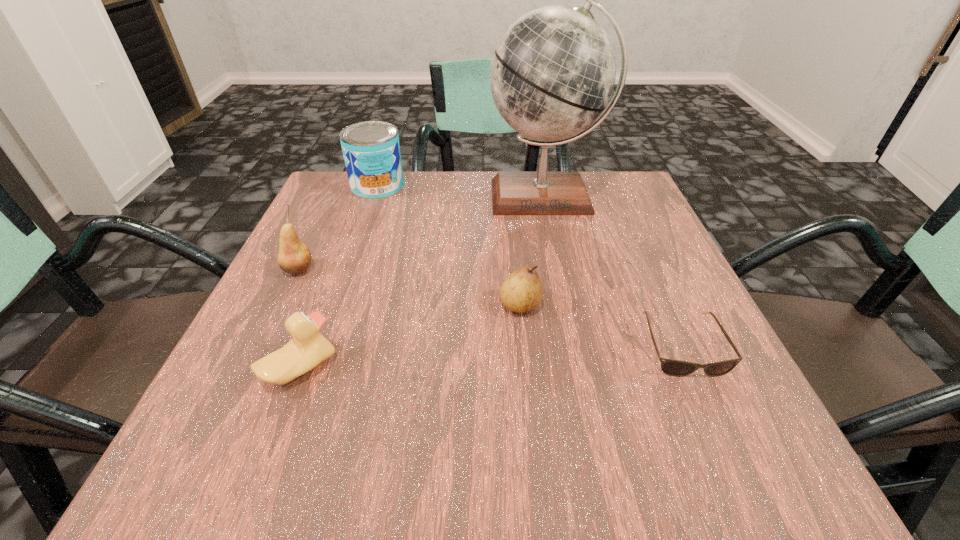
The image size is (960, 540). What are the coordinates of `vacant point located between the nearer pear and the tallest object` in the screenshot? It's located at (533, 251).

Where is `free space between the shortest object and the tallest object`? The image size is (960, 540). free space between the shortest object and the tallest object is located at coordinates (613, 272).

Find the location of a particular element. free space that is in between the nearer pear and the tallest object is located at coordinates (533, 251).

Find the location of a particular element. unoccupied area between the shorter pear and the can is located at coordinates (449, 246).

Locate an element on the screen. unoccupied area between the can and the tallest object is located at coordinates (461, 192).

This screenshot has width=960, height=540. Identify the location of vacant region between the sunglasses and the duck. (492, 357).

What are the coordinates of `unoccupied area between the globe and the shortest object` in the screenshot? It's located at (613, 272).

You are a GUI agent. You are given a task and a screenshot of the screen. Output one action in this format:
    pyautogui.click(x=<x>, y=<y>)
    Task: Click on the free area in between the can and the fourth nearest object
    The height and width of the screenshot is (540, 960).
    Given the screenshot: What is the action you would take?
    pyautogui.click(x=338, y=228)

Locate an element on the screen. empty space that is in between the tallest object and the right pear is located at coordinates (533, 251).

This screenshot has width=960, height=540. Identify the location of object that stands as the closest to the sunglasses. (522, 291).